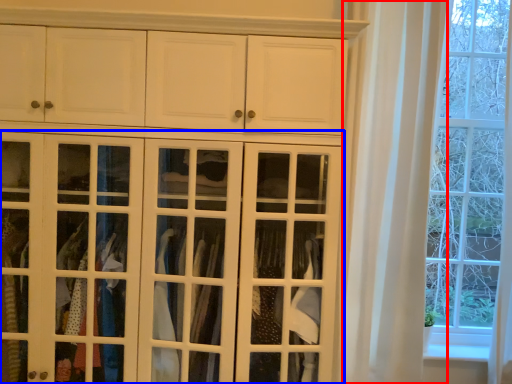
Question: Which point is closer to the camera, curtain (highlighted by a red box) or door (highlighted by a blue box)?

Choices:
 (A) curtain
 (B) door

Answer: (B)